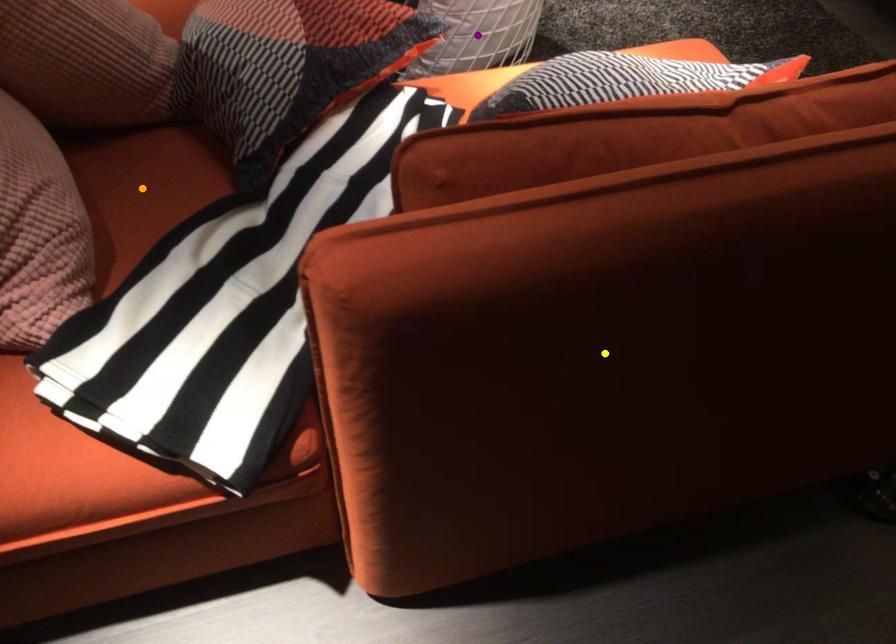
Order these from farthest to nearest:
yellow point
purple point
orange point

purple point, orange point, yellow point